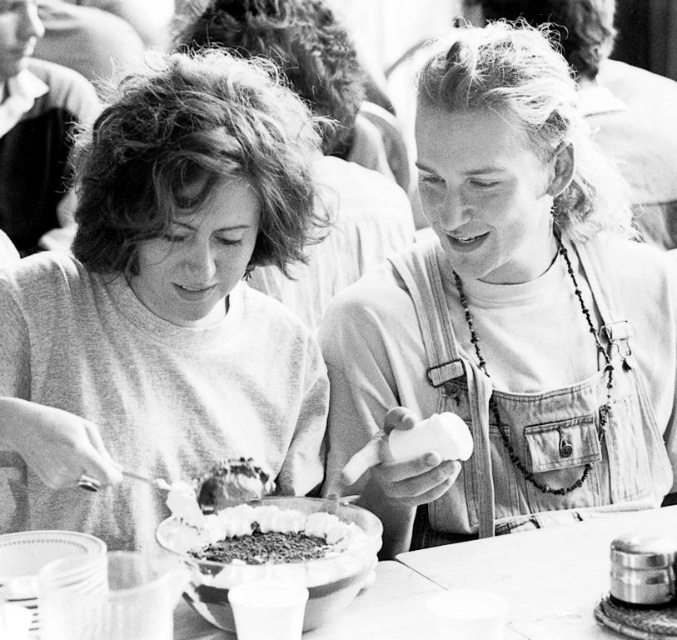
Does smooth gray shirt at center appear on the right side of smooth wooden table at center?

No, smooth gray shirt at center is not to the right of smooth wooden table at center.

Is smooth gray shirt at center thinner than smooth wooden table at center?

Yes.

Looking at this image, measure the distance between smooth gray shirt at center and camera.

smooth gray shirt at center is 1.31 meters away from camera.

Locate an element on the screen. The width and height of the screenshot is (677, 640). smooth gray shirt at center is located at coordinates (179, 280).

Who is taller, denim overalls at center or smooth wooden table at center?

With more height is denim overalls at center.

Does denim overalls at center appear on the left side of smooth wooden table at center?

Incorrect, denim overalls at center is not on the left side of smooth wooden table at center.

Which is in front, point (376, 317) or point (542, 570)?

Point (542, 570) is more forward.

Where is `denim overalls at center`? The width and height of the screenshot is (677, 640). denim overalls at center is located at coordinates (508, 314).

Which is in front, point (483, 333) or point (154, 403)?

Point (154, 403)

What do you see at coordinates (508, 314) in the screenshot? Image resolution: width=677 pixels, height=640 pixels. I see `denim overalls at center` at bounding box center [508, 314].

Who is more forward, (479, 172) or (43, 268)?

Point (43, 268)

The width and height of the screenshot is (677, 640). Identify the location of denim overalls at center. (508, 314).